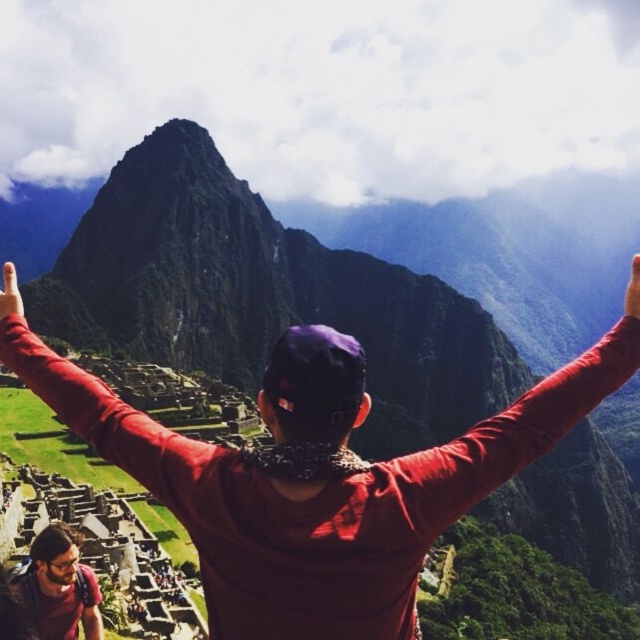
What do you see at coordinates (58, 588) in the screenshot?
I see `dark brown leather backpack at lower left` at bounding box center [58, 588].

Locate an element on the screen. dark brown leather backpack at lower left is located at coordinates (58, 588).

Image resolution: width=640 pixels, height=640 pixels. Describe the element at coordinates (58, 588) in the screenshot. I see `dark brown leather backpack at lower left` at that location.

Locate an element on the screen. dark brown leather backpack at lower left is located at coordinates (58, 588).

Who is positioned more to the left, red matte arm at upper center or matte red finger at upper right?

red matte arm at upper center

Can you confirm if red matte arm at upper center is positioned below matte red finger at upper right?

Correct, red matte arm at upper center is located below matte red finger at upper right.

The image size is (640, 640). Describe the element at coordinates (106, 419) in the screenshot. I see `red matte arm at upper center` at that location.

Find the location of a particular element. red matte arm at upper center is located at coordinates (106, 419).

Which of these two, red matte arm at upper center or matte red hand at upper left, stands taller?

matte red hand at upper left is taller.

I want to click on red matte arm at upper center, so click(x=106, y=419).

Image resolution: width=640 pixels, height=640 pixels. What are the coordinates of `red matte arm at upper center` in the screenshot? It's located at (106, 419).